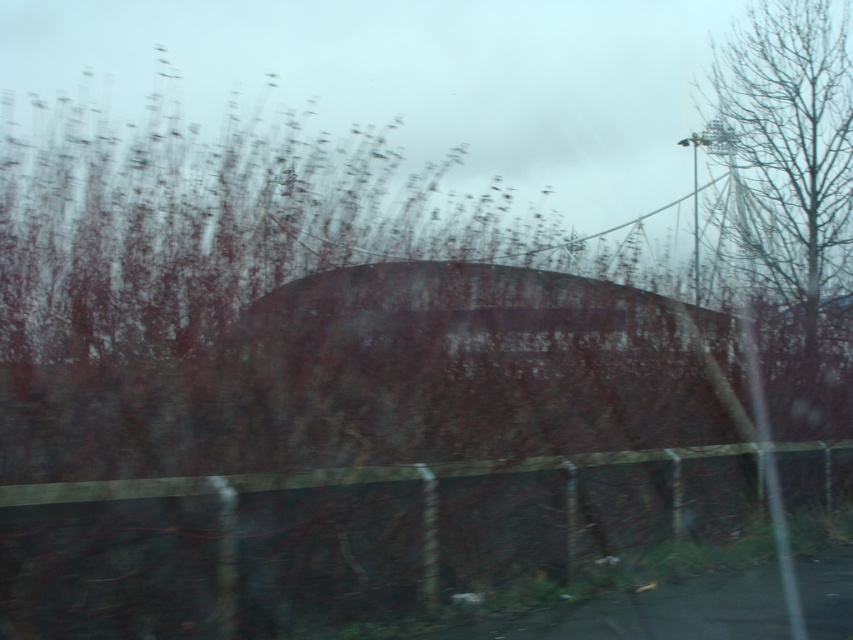
Looking at this image, is wooden fence at center positioned behind bare branches at upper right?

That is False.

Where is `wooden fence at center`? The image size is (853, 640). wooden fence at center is located at coordinates (339, 538).

Identify the location of wooden fence at center. This screenshot has width=853, height=640. (339, 538).